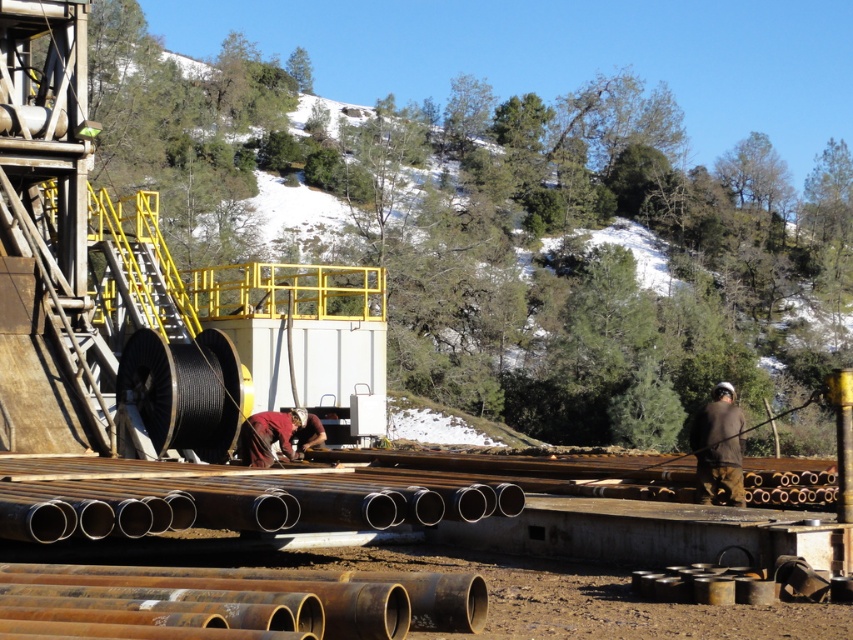
You are a safety inspector at the construction site. You notice two workers wearing brown fabric jacket at right and maroon fabric shirt at center. Which worker is standing closer to the machinery platform?

The brown fabric jacket at right is positioned under maroon fabric shirt at center, meaning the brown fabric jacket at right is closer to the machinery platform.

You are a safety inspector at the construction site. You need to ensure that the polished metallic pipes at center and the brown fabric jacket at right are kept at a safe distance as per regulations. The minimum required distance between them is 20 feet. Can you confirm if they are compliant with the safety regulations?

The polished metallic pipes at center and the brown fabric jacket at right are 21.14 feet apart from each other, which exceeds the minimum required distance of 20 feet. Therefore, they are compliant with the safety regulations.